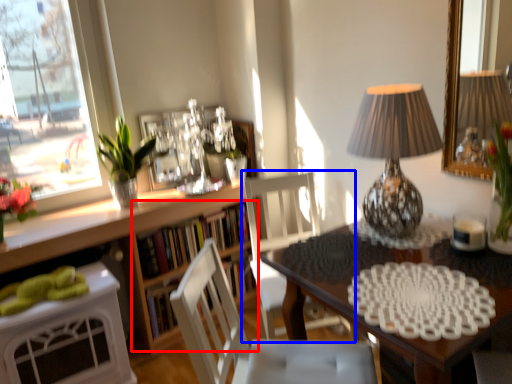
Question: Which of the following is the closest to the observer, shelf (highlighted by a red box) or chair (highlighted by a blue box)?

Choices:
 (A) shelf
 (B) chair

Answer: (B)